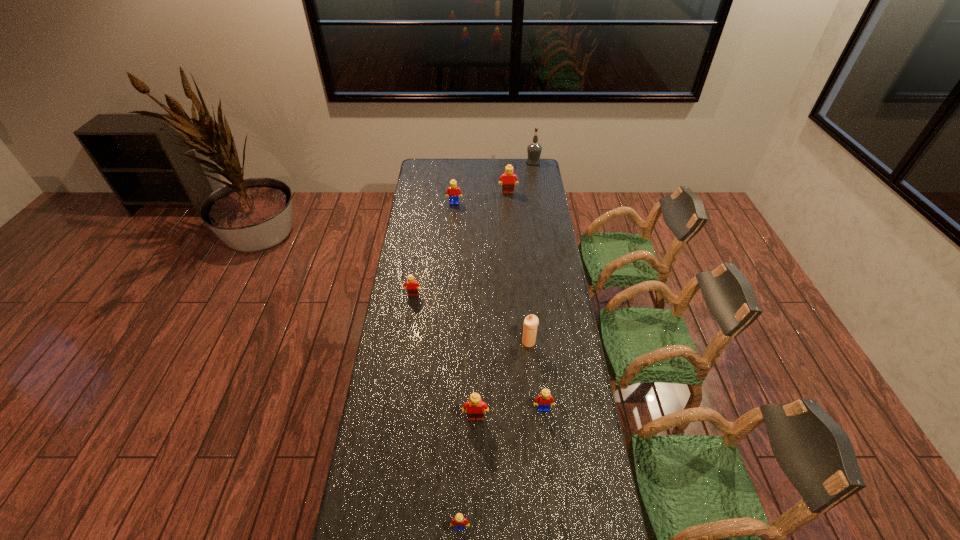
This screenshot has height=540, width=960. I want to click on unoccupied area between the vodka and the nearest Lego, so click(497, 345).

Identify the location of vacant space that is in between the vodka and the second nearest object. The width and height of the screenshot is (960, 540). (504, 290).

The image size is (960, 540). I want to click on object that is the seventh closest to the nearest yellow Lego, so click(x=534, y=149).

Locate which object ranks in proximity to the rightmost object. Please provide its 2D coordinates. Your answer should be formatted as a tuple, i.e. [(x, y)], where the tuple contains the x and y coordinates of a point satisfying the conditions above.

[(508, 177)]

The height and width of the screenshot is (540, 960). In order to click on Lego that is the third closest to the shortest object in this screenshot , I will do `click(412, 289)`.

In order to click on Lego object that ranks as the closest to the third nearest Lego in this screenshot , I will do `click(475, 405)`.

Find the location of a particular element. This screenshot has width=960, height=540. brown Lego that is the closest one to the fourth nearest object is located at coordinates (475, 405).

Locate which brown Lego ranks third in proximity to the rightmost object. Please provide its 2D coordinates. Your answer should be formatted as a tuple, i.e. [(x, y)], where the tuple contains the x and y coordinates of a point satisfying the conditions above.

[(475, 405)]

Locate an element on the screen. The height and width of the screenshot is (540, 960). the second closest yellow Lego to the biggest yellow Lego is located at coordinates (458, 522).

Locate an element on the screen. yellow Lego that is the second nearest to the fourth farthest Lego is located at coordinates (454, 192).